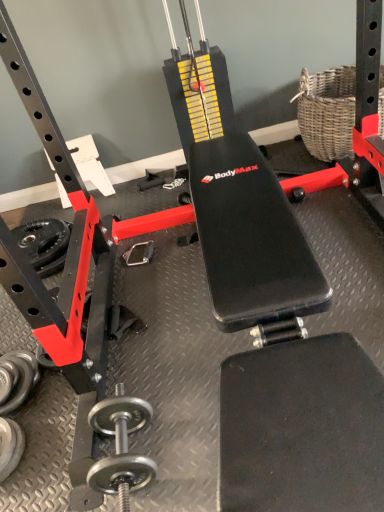
At what (x,y) coordinates should I click in order to perform the action: click on spots to the right of silver metallic dumbbell at lower left, which is the third dumbbell in right-to-left order. Please return your answer as a coordinate pair (x, y). This screenshot has width=384, height=512. Looking at the image, I should click on (50, 395).